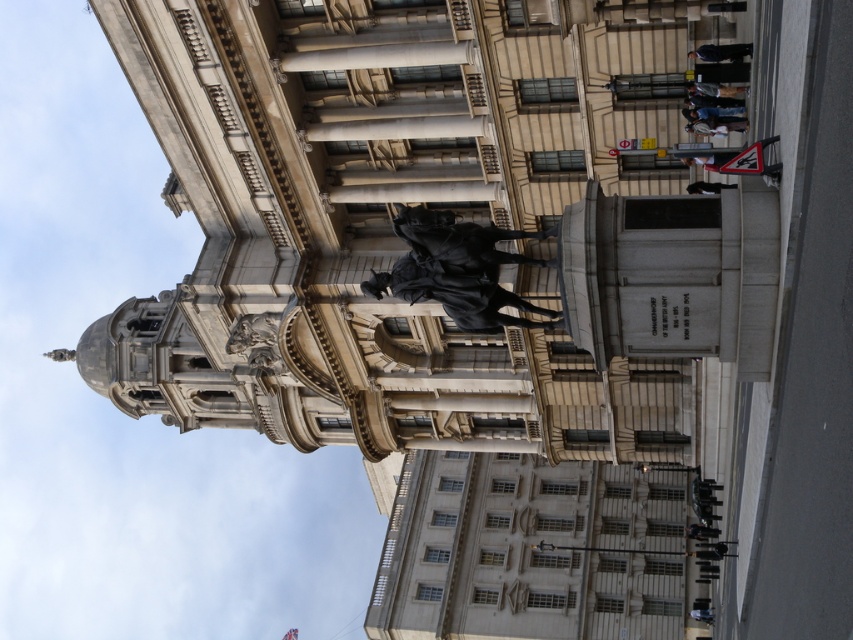
Based on the photo, you are a tour guide leading a group to the leather jacket at right. The polished bronze statue at center is an obstacle. Can you walk straight from the statue to the jacket without detour?

The polished bronze statue at center is 41.09 feet away from the leather jacket at right, so yes, you can walk straight from the statue to the jacket without needing to detour since there is enough space between them.

You are standing in front of the grand neoclassical building with the dark gray stone statue at center. If you want to take a photo of the statue without including the building in the background, where should you position yourself relative to the statue?

To avoid including the grand neoclassical building in the background when photographing the dark gray stone statue at center, position yourself directly behind the statue, as its location at point (721, 52) places it in front of the building. This positioning would allow the statue to be the focal point with an unobstructed background.